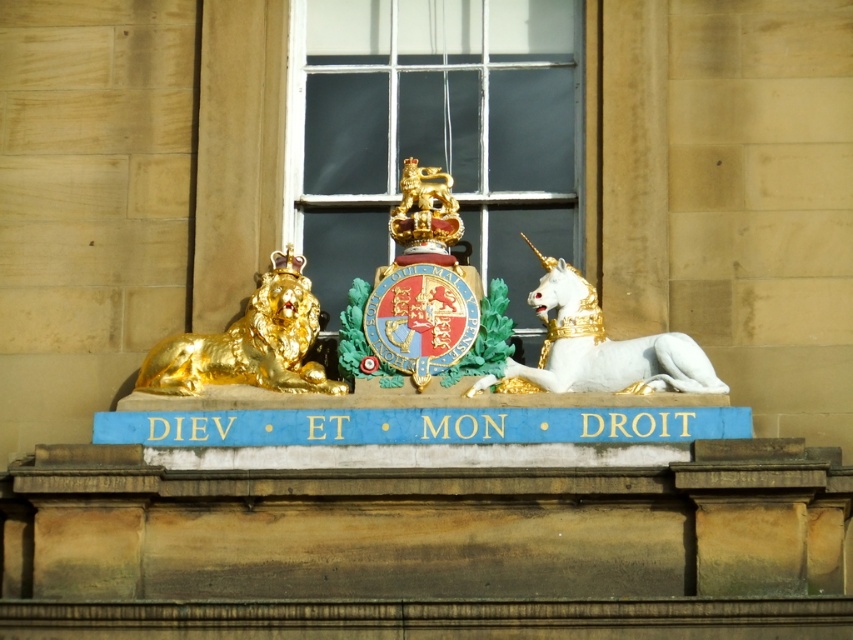
Question: Does white marble unicorn at center appear on the left side of gold polished lion at left?

Choices:
 (A) yes
 (B) no

Answer: (B)

Question: Can you confirm if white marble unicorn at center is positioned above gold polished lion at left?

Choices:
 (A) yes
 (B) no

Answer: (A)

Question: Which point is farther to the camera?

Choices:
 (A) gold polished lion at left
 (B) white marble unicorn at center

Answer: (A)

Question: Does white marble unicorn at center appear on the right side of gold polished lion at left?

Choices:
 (A) yes
 (B) no

Answer: (A)